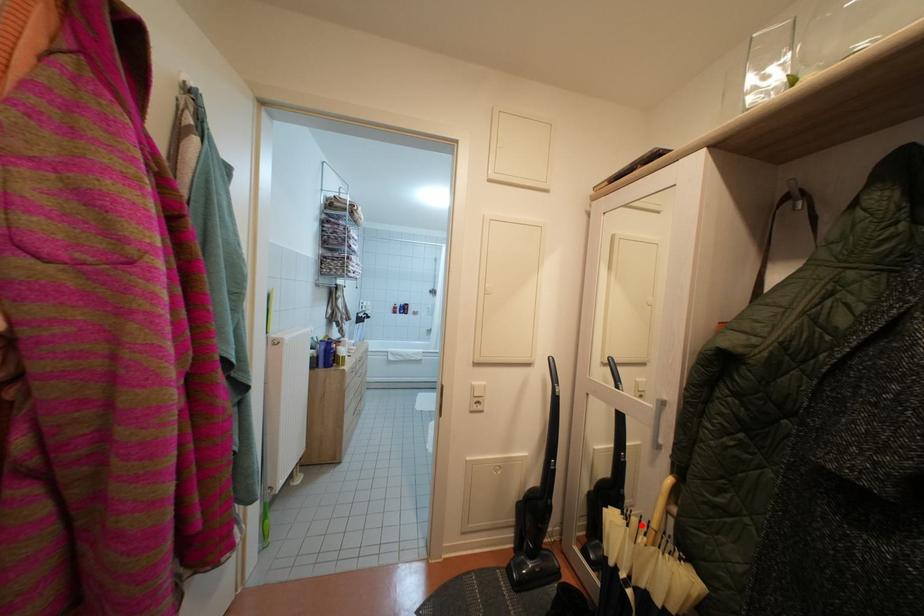
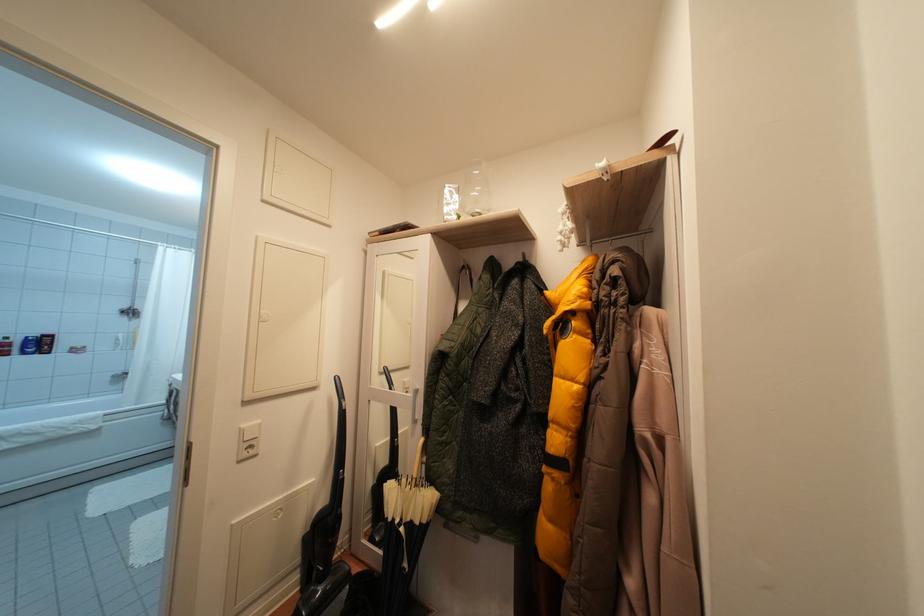
Question: I am providing you with two images of the same scene from different viewpoints. A red point is shown in image1. For the corresponding object point in image2, is it positioned nearer or farther from the camera?

Choices:
 (A) Nearer
 (B) Farther

Answer: (B)